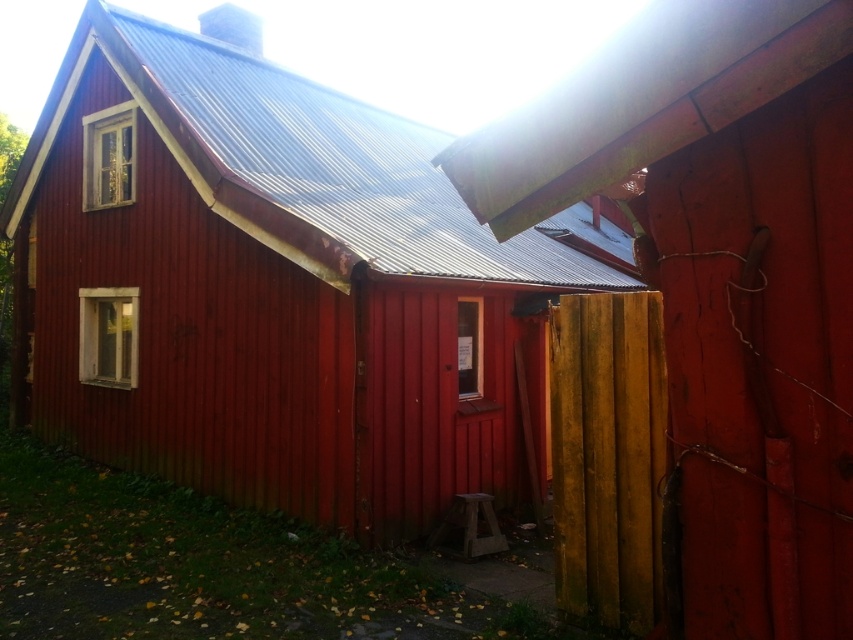
You are a painter planning to paint the wooden planks at right and the yellow wood fence at right. If you have enough paint for one of them, which one should you choose based on their widths?

The wooden planks at right are wider than the yellow wood fence at right, so you should choose to paint the wooden planks at right first.

You are standing at the point marked as point [271,288] in the image. What structure is directly beneath you?

The smooth wooden cabin at center is located at point [271,288], so the structure directly beneath you is the smooth wooden cabin at center.

Where is the smooth wooden cabin at center located in terms of coordinates?

The smooth wooden cabin at center is located at point (x=271, y=288).